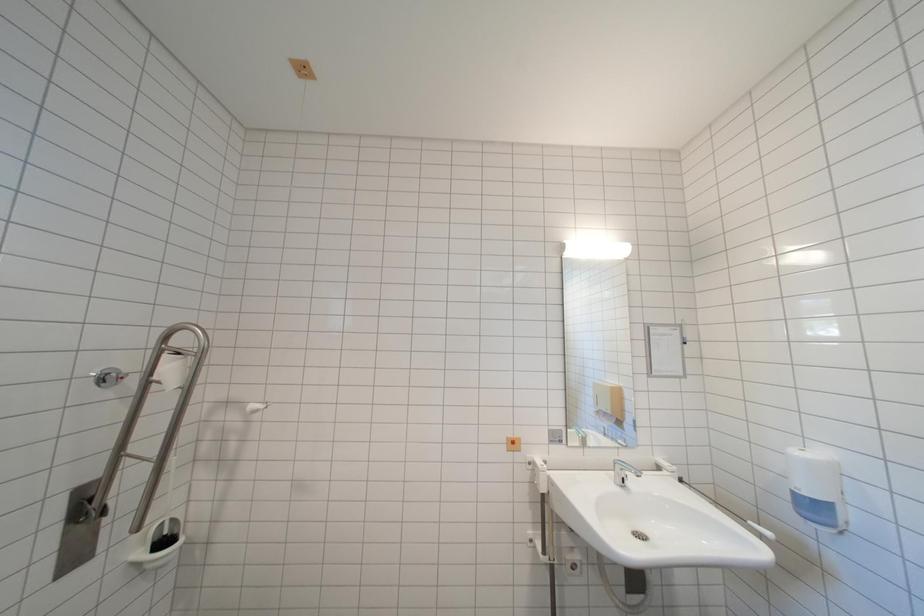
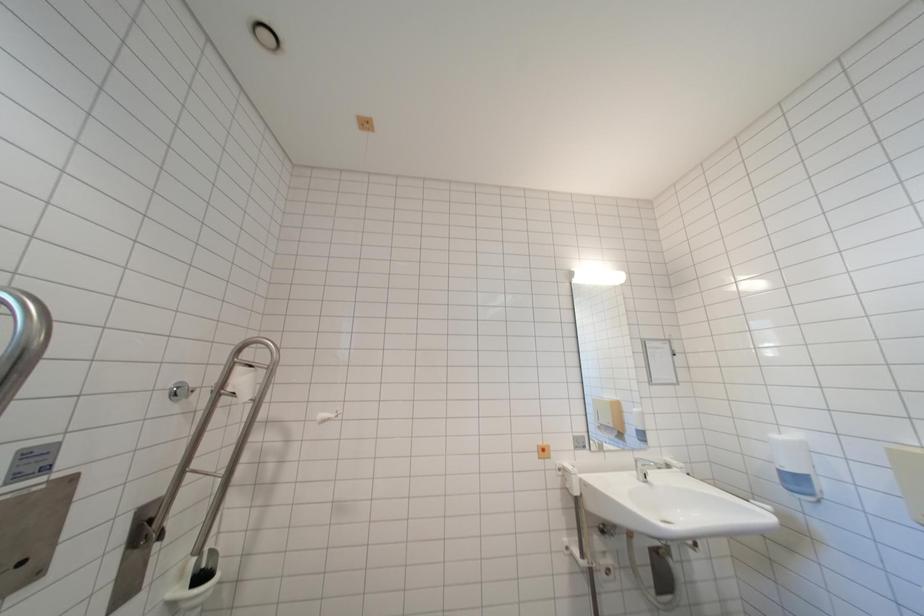
Question: How did the camera likely rotate?

Choices:
 (A) Left
 (B) Right
 (C) Up
 (D) Down

Answer: (C)